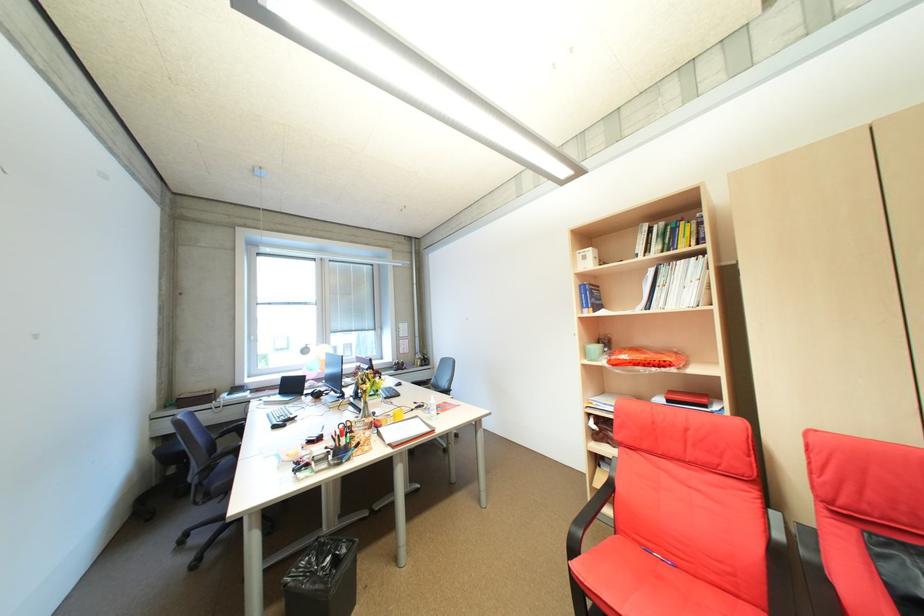
You are a GUI agent. You are given a task and a screenshot of the screen. Output one action in this format:
    pyautogui.click(x=<x>, y=<y>)
    Task: Click on the black trash can
    
    Given the screenshot: What is the action you would take?
    pyautogui.click(x=322, y=578)